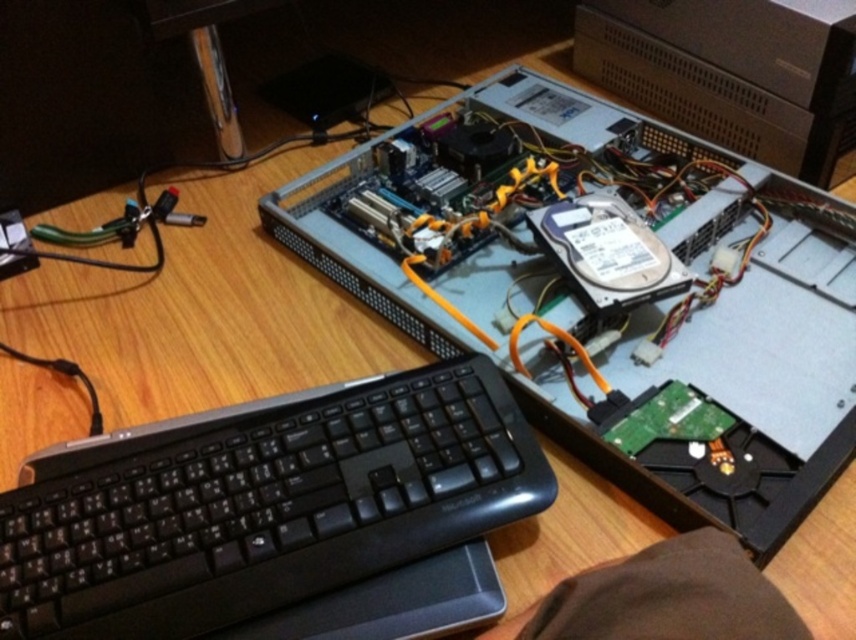
Question: Can you confirm if silver metallic computer at center is positioned above sleek silver desktop at upper center?

Choices:
 (A) yes
 (B) no

Answer: (B)

Question: Which point is closer to the camera?

Choices:
 (A) (783, 477)
 (B) (849, 97)

Answer: (A)

Question: Which object is farther from the camera taking this photo?

Choices:
 (A) silver metallic computer at center
 (B) black plastic keyboard at lower left
 (C) sleek silver desktop at upper center

Answer: (C)

Question: Considering the relative positions of black plastic keyboard at lower left and sleek silver desktop at upper center in the image provided, where is black plastic keyboard at lower left located with respect to sleek silver desktop at upper center?

Choices:
 (A) below
 (B) above

Answer: (A)

Question: Which point is farther from the camera taking this photo?

Choices:
 (A) (682, 74)
 (B) (381, 212)

Answer: (A)

Question: Is silver metallic computer at center bigger than sleek silver desktop at upper center?

Choices:
 (A) no
 (B) yes

Answer: (B)